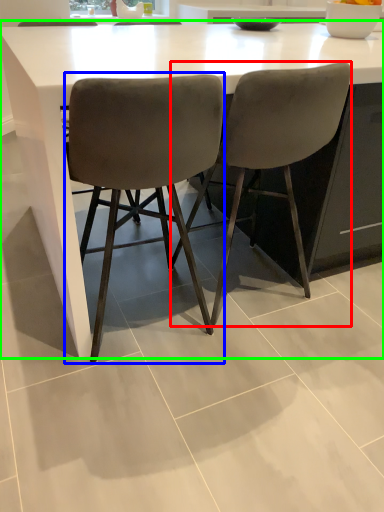
Question: Based on their relative distances, which object is nearer to chair (highlighted by a red box)? Choose from chair (highlighted by a blue box) and table (highlighted by a green box).

Choices:
 (A) chair
 (B) table

Answer: (A)